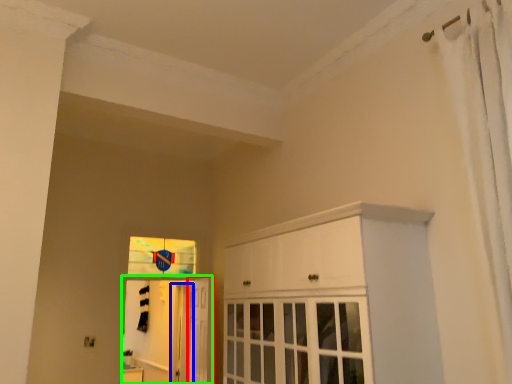
Question: Estimate the real-world distances between objects in this image. Which object is closer to door (highlighted by a red box), screen door (highlighted by a blue box) or elevator (highlighted by a green box)?

Choices:
 (A) screen door
 (B) elevator

Answer: (A)